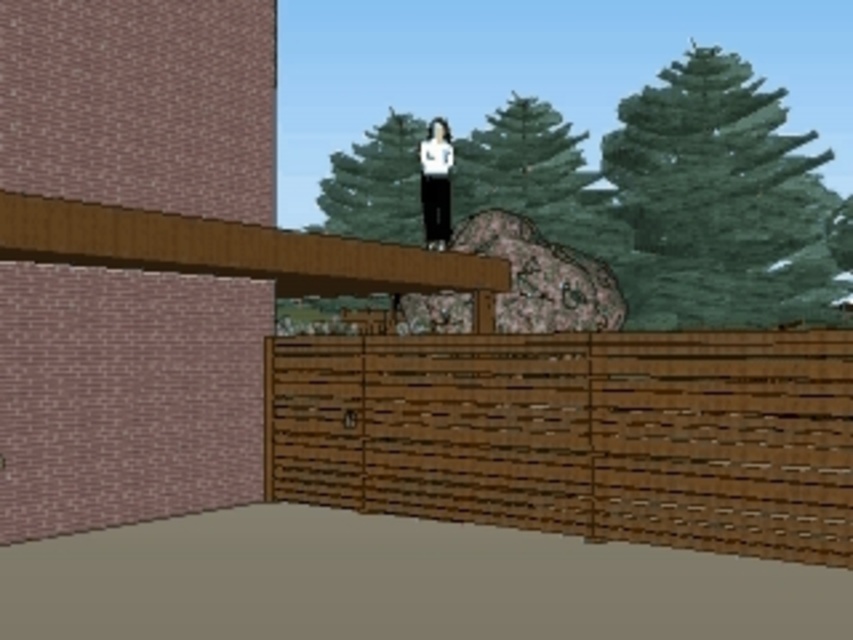
You are navigating a virtual environment and need to determine the spatial relationship between two points. Given that you are facing north, can you confirm if point (605, 280) is located behind point (432, 131) from your perspective?

Point (605, 280) is behind point (432, 131), so yes, from your north facing perspective, point (605, 280) is located behind point (432, 131).

You are a contractor assessing a construction site. You notice the rustic stone at center and the white matte pants at center. Which object is taller?

The rustic stone at center is taller than the white matte pants at center.